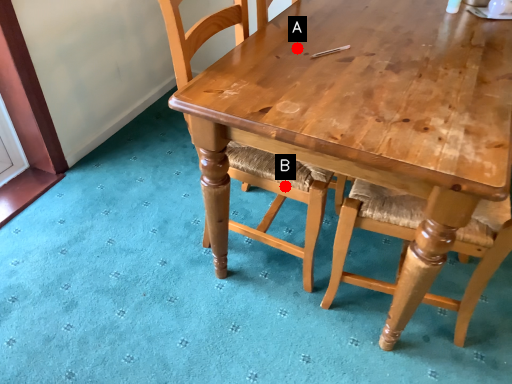
Question: Two points are circled on the image, labeled by A and B beside each circle. Which point is farther from the camera taking this photo?

Choices:
 (A) A is further
 (B) B is further

Answer: (B)